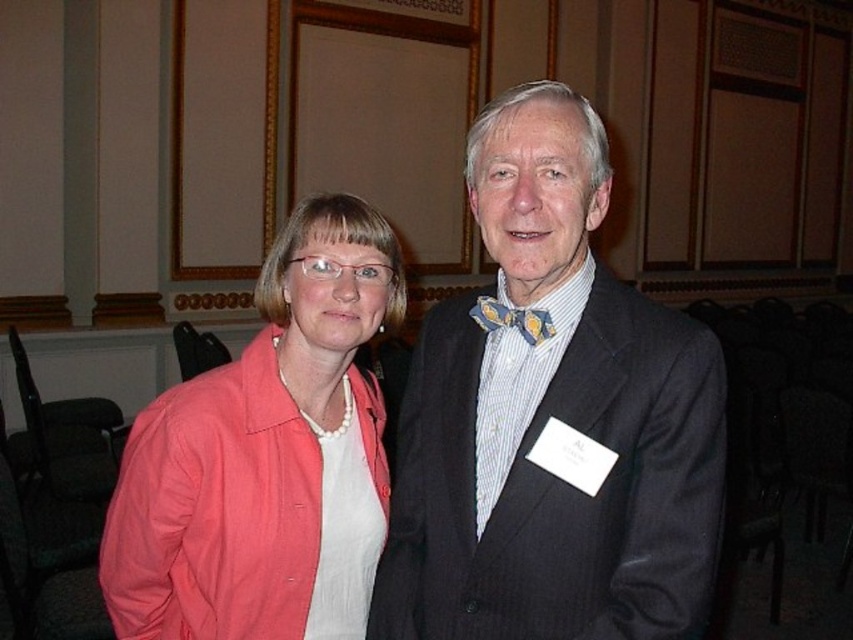
What do you see at coordinates (550, 417) in the screenshot? I see `matte black suit at center` at bounding box center [550, 417].

Consider the image. Can you confirm if matte black suit at center is positioned below coral fabric jacket at left?

No.

Which is in front, point (695, 433) or point (132, 536)?

Point (695, 433)

The height and width of the screenshot is (640, 853). What are the coordinates of `matte black suit at center` in the screenshot? It's located at (550, 417).